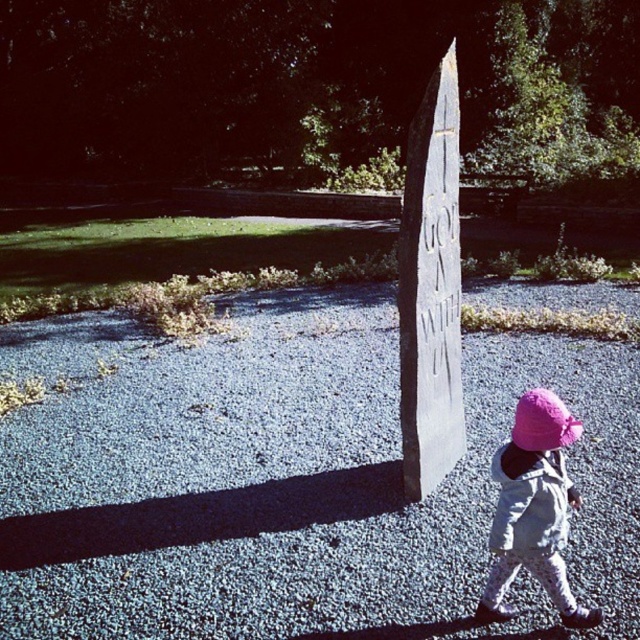
Can you confirm if gray gravel at center is wider than pink fabric hat at lower right?

Indeed, gray gravel at center has a greater width compared to pink fabric hat at lower right.

Between point (68, 358) and point (516, 516), which one is positioned in front?

Point (516, 516)

Where is `gray gravel at center`? gray gravel at center is located at coordinates click(x=289, y=481).

You are a GUI agent. You are given a task and a screenshot of the screen. Output one action in this format:
    pyautogui.click(x=<x>, y=<y>)
    Task: Click on the gray gravel at center
    The height and width of the screenshot is (640, 640).
    Given the screenshot: What is the action you would take?
    pyautogui.click(x=289, y=481)

Which is more to the left, gray gravel at center or gray stone monument at center?

Positioned to the left is gray gravel at center.

Image resolution: width=640 pixels, height=640 pixels. I want to click on gray gravel at center, so click(x=289, y=481).

Does point (596, 355) lie in front of point (435, 381)?

No, (596, 355) is behind (435, 381).

Where is `gray gravel at center`? The width and height of the screenshot is (640, 640). gray gravel at center is located at coordinates (289, 481).

Which is more to the left, gray stone monument at center or pink fabric hat at lower right?

Positioned to the left is gray stone monument at center.

Can you confirm if gray stone monument at center is shorter than pink fabric hat at lower right?

No.

The width and height of the screenshot is (640, 640). What do you see at coordinates (429, 289) in the screenshot? I see `gray stone monument at center` at bounding box center [429, 289].

This screenshot has width=640, height=640. Identify the location of gray stone monument at center. (429, 289).